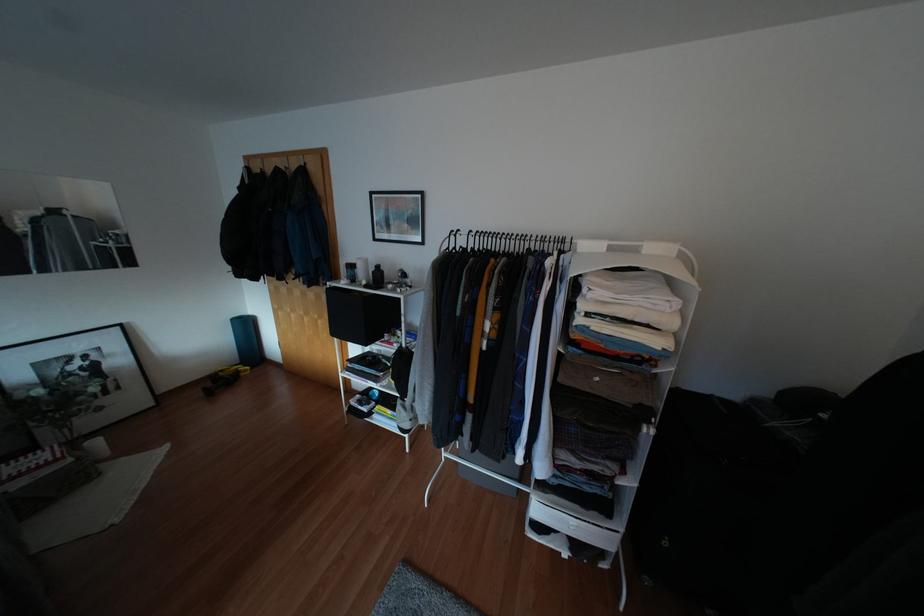
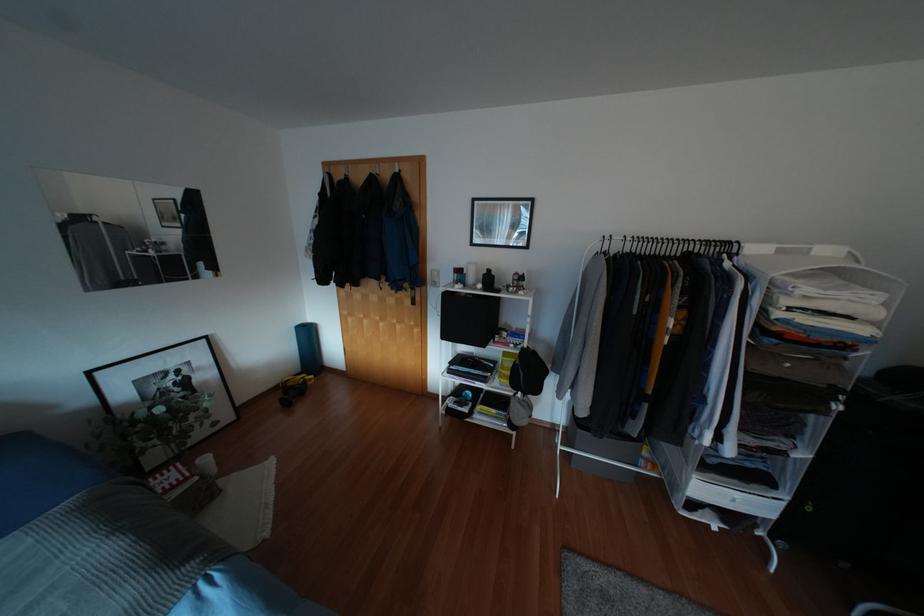
In the second image, find the point that corresponds to (241,374) in the first image.

(309, 383)